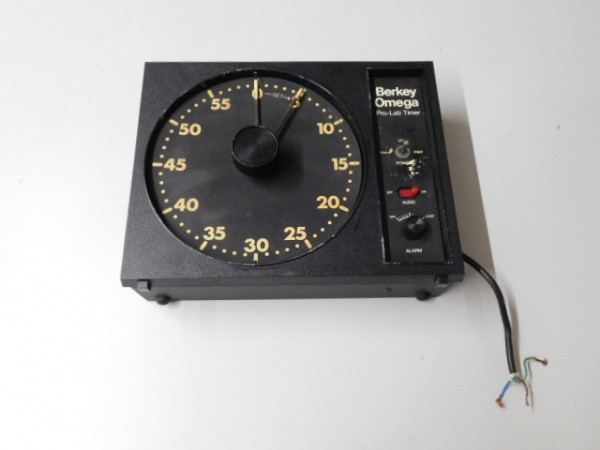
The height and width of the screenshot is (450, 600). Identify the location of red switch. (410, 190).